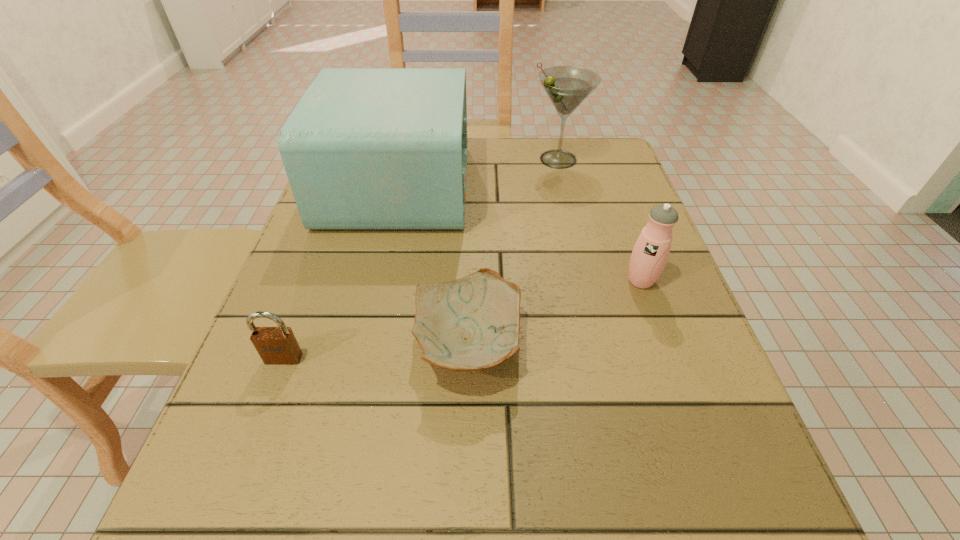
In order to click on martini in this screenshot , I will do `click(567, 87)`.

Where is `radio receiver`? radio receiver is located at coordinates (365, 148).

This screenshot has height=540, width=960. In order to click on the third nearest object in this screenshot , I will do `click(649, 256)`.

Image resolution: width=960 pixels, height=540 pixels. Find the location of `thermos bottle`. thermos bottle is located at coordinates (649, 256).

Identify the location of the second shortest object. [x=275, y=345].

This screenshot has width=960, height=540. What are the coordinates of `the shortest object` in the screenshot? It's located at (473, 323).

Locate an element on the screen. This screenshot has height=540, width=960. vacant region located 0.380m on the left of the martini is located at coordinates (376, 159).

Identify the location of free space located on the front panel of the radio receiver. The height and width of the screenshot is (540, 960). (564, 185).

The image size is (960, 540). What are the coordinates of `free space located on the back of the third shortest object` in the screenshot? It's located at (611, 198).

Find the location of a particular element. This screenshot has width=960, height=540. free space located on the front-facing side of the fourth tallest object is located at coordinates (235, 489).